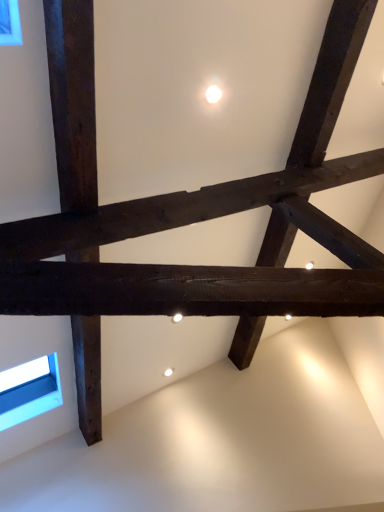
This screenshot has width=384, height=512. In order to click on blue glass window at lower left in this screenshot , I will do `click(29, 390)`.

The width and height of the screenshot is (384, 512). What do you see at coordinates (29, 390) in the screenshot? I see `blue glass window at lower left` at bounding box center [29, 390].

Identify the location of blue glass window at lower left. The width and height of the screenshot is (384, 512). (29, 390).